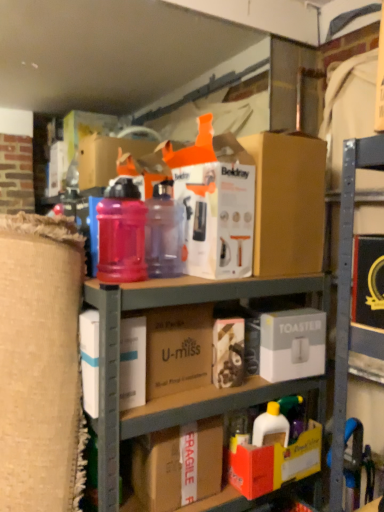
Image resolution: width=384 pixels, height=512 pixels. What are the coordinates of `cardboard boxes at center` in the screenshot? It's located at (184, 391).

Image resolution: width=384 pixels, height=512 pixels. I want to click on brown cardboard at center, the 2th cardboard box positioned from the bottom, so click(x=178, y=349).

Is brown cardboard box at upper center, acting as the fourth box starting from the bottom, smaller than white cardboard toaster at center, which appears as the 3th box when ordered from the bottom?

No.

Is brown cardboard box at upper center, acting as the fourth box starting from the bottom, taller than white cardboard toaster at center, which appears as the 3th box when ordered from the bottom?

Correct, brown cardboard box at upper center, acting as the fourth box starting from the bottom, is much taller as white cardboard toaster at center, which appears as the 3th box when ordered from the bottom.

From a real-world perspective, is brown cardboard box at upper center, which appears as the 1th box when viewed from the top, positioned above or below white cardboard toaster at center, which ranks as the 2th box in top-to-bottom order?

brown cardboard box at upper center, which appears as the 1th box when viewed from the top, is situated higher than white cardboard toaster at center, which ranks as the 2th box in top-to-bottom order, in the real world.

Which is in front, translucent plastic water bottle at center, which is counted as the second bottle, starting from the right, or brown cardboard at center, which is the first cardboard box in top-to-bottom order?

translucent plastic water bottle at center, which is counted as the second bottle, starting from the right, is closer to the camera.

From a real-world perspective, who is located higher, translucent plastic water bottle at center, the first bottle when ordered from left to right, or brown cardboard at center, the 2th cardboard box positioned from the bottom?

translucent plastic water bottle at center, the first bottle when ordered from left to right, is physically above.

From the image's perspective, which is below, translucent plastic water bottle at center, arranged as the 2th bottle when viewed from the left, or white cardboard toaster at center, which appears as the 3th box when ordered from the bottom?

white cardboard toaster at center, which appears as the 3th box when ordered from the bottom, is shown below in the image.

You are a GUI agent. You are given a task and a screenshot of the screen. Output one action in this format:
    pyautogui.click(x=<x>, y=<y>)
    Task: Click on the box that is the 3rd object to the right of the translucent plastic water bottle at center, acting as the 1th bottle starting from the right, starting at the anchor
    This screenshot has height=512, width=384.
    Given the screenshot: What is the action you would take?
    pyautogui.click(x=292, y=344)

Are translucent plastic water bottle at center, arranged as the 2th bottle when viewed from the left, and white cardboard toaster at center, which appears as the 3th box when ordered from the bottom, beside each other?

No, translucent plastic water bottle at center, arranged as the 2th bottle when viewed from the left, is not making contact with white cardboard toaster at center, which appears as the 3th box when ordered from the bottom.

Considering the positions of objects translucent plastic water bottle at center, acting as the 1th bottle starting from the right, and white cardboard toaster at center, which ranks as the 2th box in top-to-bottom order, in the image provided, who is more to the left, translucent plastic water bottle at center, acting as the 1th bottle starting from the right, or white cardboard toaster at center, which ranks as the 2th box in top-to-bottom order,?

translucent plastic water bottle at center, acting as the 1th bottle starting from the right.

Based on the photo, is translucent plastic water bottle at center, arranged as the 2th bottle when viewed from the left, touching white cardboard box at center, which is the 2th box in bottom-to-top order?

No, translucent plastic water bottle at center, arranged as the 2th bottle when viewed from the left, is not making contact with white cardboard box at center, which is the 2th box in bottom-to-top order.

Looking at this image, would you say translucent plastic water bottle at center, arranged as the 2th bottle when viewed from the left, contains white cardboard box at center, marked as the third box in a top-to-bottom arrangement?

No.

Based on the photo, how many degrees apart are the facing directions of translucent plastic water bottle at center, arranged as the 2th bottle when viewed from the left, and white cardboard box at center, marked as the third box in a top-to-bottom arrangement?

translucent plastic water bottle at center, arranged as the 2th bottle when viewed from the left, and white cardboard box at center, marked as the third box in a top-to-bottom arrangement, are facing 3.09 degrees away from each other.

Is translucent plastic water bottle at center, acting as the 1th bottle starting from the right, oriented towards white cardboard box at center, marked as the third box in a top-to-bottom arrangement?

No, translucent plastic water bottle at center, acting as the 1th bottle starting from the right, is not aimed at white cardboard box at center, marked as the third box in a top-to-bottom arrangement.

Between cardboard boxes at center and white cardboard toaster at center, which appears as the 3th box when ordered from the bottom, which one has larger width?

cardboard boxes at center is wider.

Which is more to the left, cardboard boxes at center or white cardboard toaster at center, which appears as the 3th box when ordered from the bottom?

cardboard boxes at center.

Considering the relative sizes of cardboard boxes at center and white cardboard toaster at center, which ranks as the 2th box in top-to-bottom order, in the image provided, is cardboard boxes at center taller than white cardboard toaster at center, which ranks as the 2th box in top-to-bottom order,?

Indeed, cardboard boxes at center has a greater height compared to white cardboard toaster at center, which ranks as the 2th box in top-to-bottom order.

From the image's perspective, which is below, cardboard boxes at center or white cardboard toaster at center, which appears as the 3th box when ordered from the bottom?

cardboard boxes at center is shown below in the image.

Does white cardboard toaster at center, which ranks as the 2th box in top-to-bottom order, come in front of white cardboard box at center, marked as the third box in a top-to-bottom arrangement?

No, it is not.

Is white cardboard toaster at center, which appears as the 3th box when ordered from the bottom, positioned far away from white cardboard box at center, marked as the third box in a top-to-bottom arrangement?

No, there isn't a large distance between white cardboard toaster at center, which appears as the 3th box when ordered from the bottom, and white cardboard box at center, marked as the third box in a top-to-bottom arrangement.

From the image's perspective, between white cardboard toaster at center, which appears as the 3th box when ordered from the bottom, and white cardboard box at center, marked as the third box in a top-to-bottom arrangement, which one is located above?

From the image's view, white cardboard toaster at center, which appears as the 3th box when ordered from the bottom, is above.

Does point (306, 358) come behind point (89, 340)?

Yes, point (306, 358) is farther from viewer.

I want to click on cardboard box that is the 2nd one when counting upward from the red cardboard box at lower center, acting as the first box starting from the bottom (from the image's perspective), so click(178, 349).

Based on the photo, which is in front, red cardboard box at lower center, the fourth box viewed from the top, or brown cardboard at center, the 2th cardboard box positioned from the bottom?

brown cardboard at center, the 2th cardboard box positioned from the bottom, is more forward.

From the image's perspective, is red cardboard box at lower center, the fourth box viewed from the top, located above brown cardboard at center, the 2th cardboard box positioned from the bottom?

No, from the image's perspective, red cardboard box at lower center, the fourth box viewed from the top, is not on top of brown cardboard at center, the 2th cardboard box positioned from the bottom.

Does red cardboard box at lower center, acting as the first box starting from the bottom, have a larger size compared to brown cardboard at center, the 2th cardboard box positioned from the bottom?

No.

The width and height of the screenshot is (384, 512). There is a white cardboard toaster at center, which ranks as the 2th box in top-to-bottom order. Identify the location of the 2nd box above it (from a real-world perspective). (287, 203).

At what (x,y) coordinates should I click in order to perform the action: click on the 1st bottle above the brown cardboard at center, which is the first cardboard box in top-to-bottom order (from the image's perspective). Please return your answer as a coordinate pair (x, y). Looking at the image, I should click on (121, 234).

Looking at the image, which one is located further to brown cardboard at center, the 2th cardboard box positioned from the bottom, red cardboard box at lower center, the fourth box viewed from the top, or fragile cardboard box at lower center, which is the 2th cardboard box in top-to-bottom order?

red cardboard box at lower center, the fourth box viewed from the top, lies further to brown cardboard at center, the 2th cardboard box positioned from the bottom, than the other object.

Estimate the real-world distances between objects in this image. Which object is further from cardboard boxes at center, white cardboard toaster at center, which ranks as the 2th box in top-to-bottom order, or white cardboard box at center, marked as the third box in a top-to-bottom arrangement?

Based on the image, white cardboard toaster at center, which ranks as the 2th box in top-to-bottom order, appears to be further to cardboard boxes at center.

From the image, which object appears to be nearer to white cardboard toaster at center, which appears as the 3th box when ordered from the bottom, brown cardboard box at upper center, which appears as the 1th box when viewed from the top, or translucent plastic water bottle at center, which is counted as the second bottle, starting from the right?

brown cardboard box at upper center, which appears as the 1th box when viewed from the top.

Which object lies nearer to the anchor point fragile cardboard box at lower center, which is the 2th cardboard box in top-to-bottom order, red cardboard box at lower center, the fourth box viewed from the top, or brown cardboard at center, which is the first cardboard box in top-to-bottom order?

The object closer to fragile cardboard box at lower center, which is the 2th cardboard box in top-to-bottom order, is red cardboard box at lower center, the fourth box viewed from the top.

Looking at the image, which one is located closer to brown cardboard at center, which is the first cardboard box in top-to-bottom order, translucent plastic water bottle at center, acting as the 1th bottle starting from the right, or cardboard boxes at center?

cardboard boxes at center is positioned closer to the anchor brown cardboard at center, which is the first cardboard box in top-to-bottom order.

Estimate the real-world distances between objects in this image. Which object is closer to white cardboard box at center, which is the 2th box in bottom-to-top order, brown cardboard box at upper center, which appears as the 1th box when viewed from the top, or translucent plastic water bottle at center, the first bottle when ordered from left to right?

translucent plastic water bottle at center, the first bottle when ordered from left to right, is positioned closer to the anchor white cardboard box at center, which is the 2th box in bottom-to-top order.

Looking at the image, which one is located closer to brown cardboard at center, which is the first cardboard box in top-to-bottom order, translucent plastic water bottle at center, arranged as the 2th bottle when viewed from the left, or white cardboard toaster at center, which appears as the 3th box when ordered from the bottom?

translucent plastic water bottle at center, arranged as the 2th bottle when viewed from the left.

From the picture: Estimate the real-world distances between objects in this image. Which object is closer to brown cardboard at center, the 2th cardboard box positioned from the bottom, red cardboard box at lower center, acting as the first box starting from the bottom, or translucent plastic water bottle at center, arranged as the 2th bottle when viewed from the left?

The object closer to brown cardboard at center, the 2th cardboard box positioned from the bottom, is translucent plastic water bottle at center, arranged as the 2th bottle when viewed from the left.

Find the location of a particular element. shelf between brown cardboard at center, which is the first cardboard box in top-to-bottom order, and white cardboard toaster at center, which appears as the 3th box when ordered from the bottom is located at coordinates (184, 391).

Identify the location of shelf situated between fragile cardboard box at lower center, acting as the 1th cardboard box starting from the bottom, and white cardboard toaster at center, which appears as the 3th box when ordered from the bottom, from left to right. This screenshot has width=384, height=512. [x=184, y=391].

This screenshot has width=384, height=512. I want to click on cardboard box between translucent plastic water bottle at center, acting as the 1th bottle starting from the right, and fragile cardboard box at lower center, acting as the 1th cardboard box starting from the bottom, vertically, so click(x=178, y=349).

The height and width of the screenshot is (512, 384). In order to click on shelf located between white cardboard box at center, which is the 2th box in bottom-to-top order, and white cardboard toaster at center, which ranks as the 2th box in top-to-bottom order, in the left-right direction in this screenshot , I will do `click(184, 391)`.